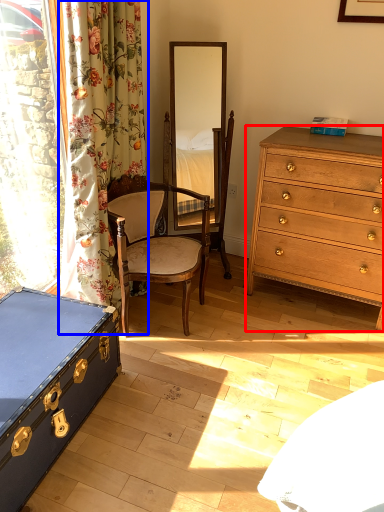
Question: Which object appears farthest to the camera in this image, chest of drawers (highlighted by a red box) or curtain (highlighted by a blue box)?

Choices:
 (A) chest of drawers
 (B) curtain

Answer: (A)